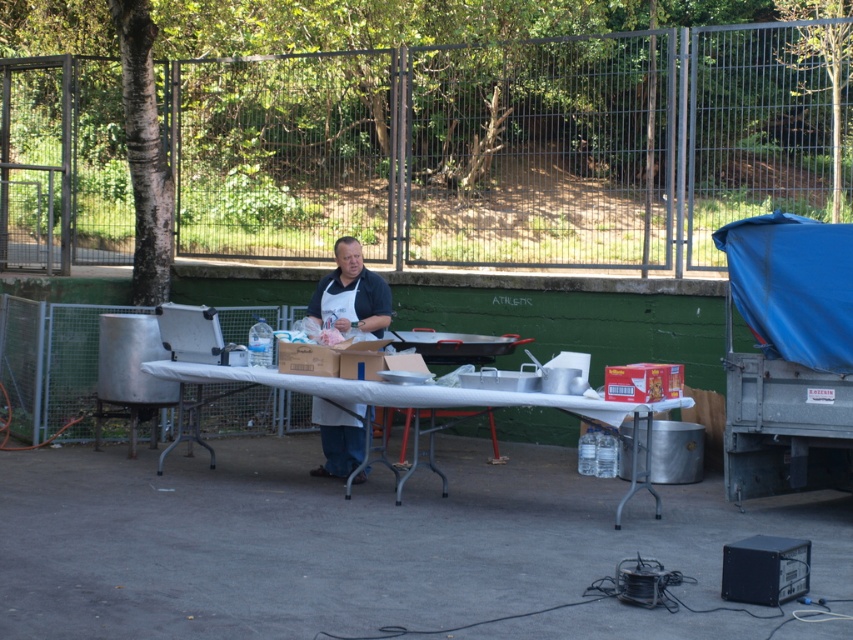
You are standing at the edge of the table in the outdoor cooking setup. There is a matte apron at center located at point (351,296). If you want to reach the matte apron at center, in which direction should you move from your current position?

The matte apron at center is located at point (351,296), so you should move towards the center of the table to reach it.

You are standing at the entrance of the outdoor cooking area and want to locate the white plastic table at center. According to the coordinates provided, is the table positioned closer to the front or the back of the scene?

The white plastic table at center is located at coordinates point (x=407, y=392), which places it closer to the back of the scene since the y coordinate is closer to 1.0 than 0.0.

In the scene shown: You are setting up a picnic and need to decide where to place your snacks. You have a white plastic table at center and a brown cardboard box at center. Which object can accommodate a larger snack container?

The white plastic table at center is bigger than the brown cardboard box at center, so it can accommodate a larger snack container.